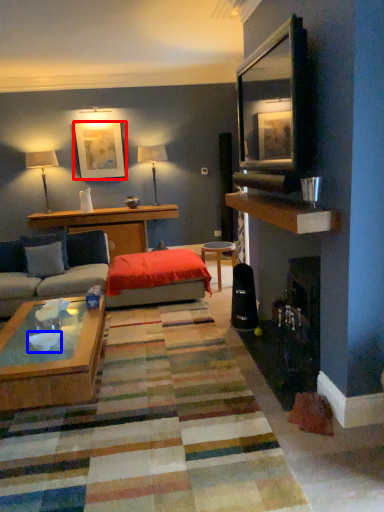
Question: Which point is further to the camera, picture frame (highlighted by a red box) or bowl (highlighted by a blue box)?

Choices:
 (A) picture frame
 (B) bowl

Answer: (A)